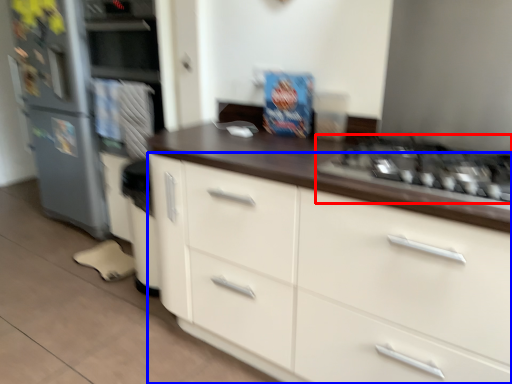
Question: Which of the following is the closest to the observer, gas stove (highlighted by a red box) or cabinetry (highlighted by a blue box)?

Choices:
 (A) gas stove
 (B) cabinetry

Answer: (B)